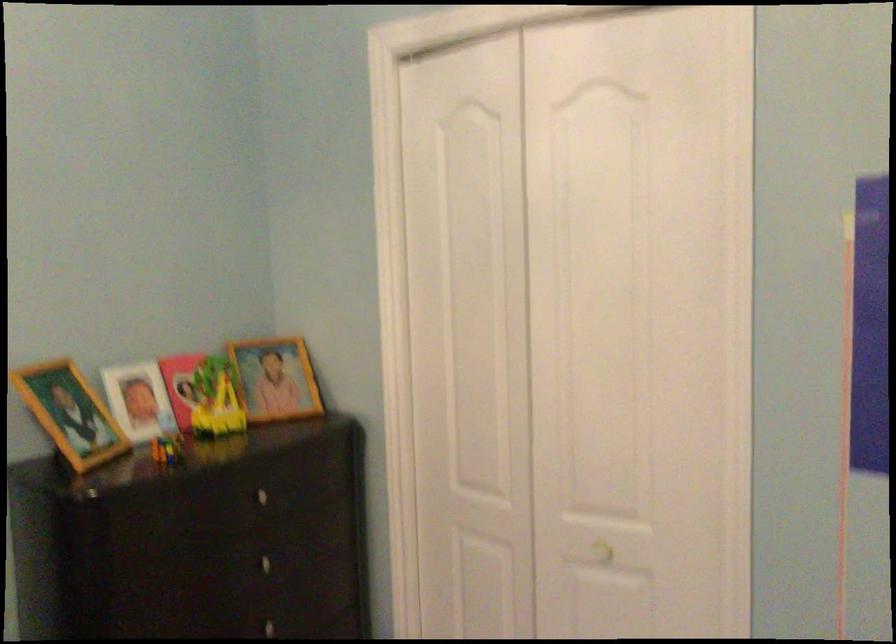
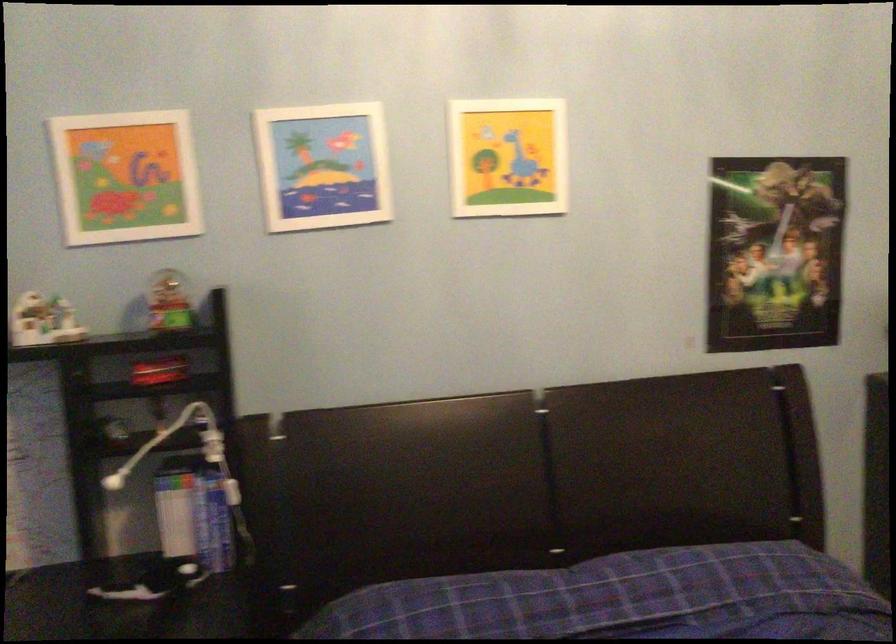
Question: The camera is either moving clockwise (left) or counter-clockwise (right) around the object. The first image is from the beginning of the video and the second image is from the end. Is the camera moving left or right when shooting the video?

Choices:
 (A) Left
 (B) Right

Answer: (B)